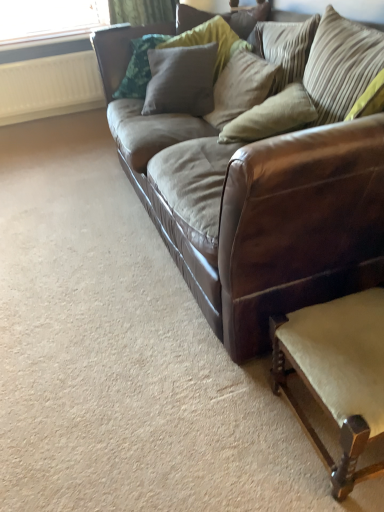
Where is `space that is in front of white ribbed radiator at upper left`? space that is in front of white ribbed radiator at upper left is located at coordinates (36, 129).